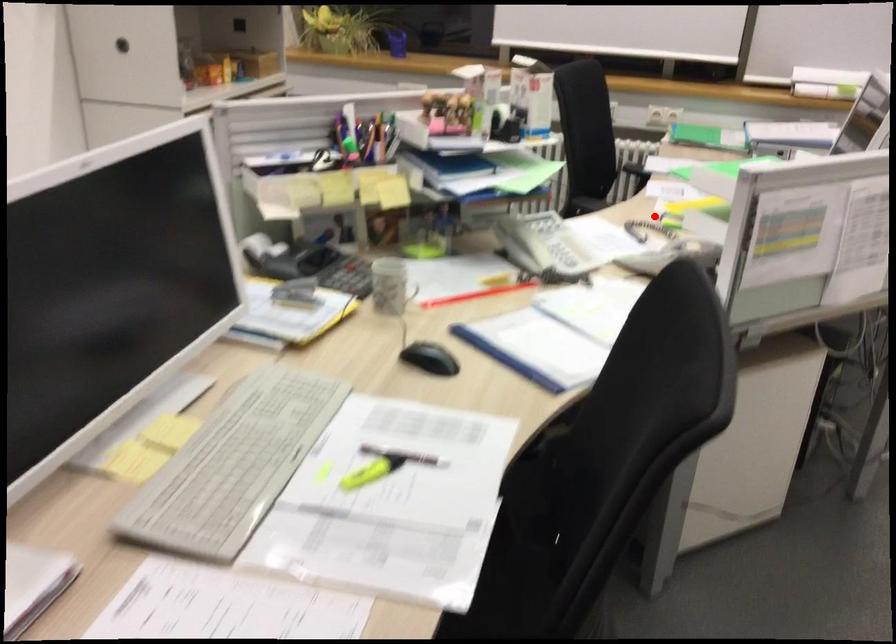
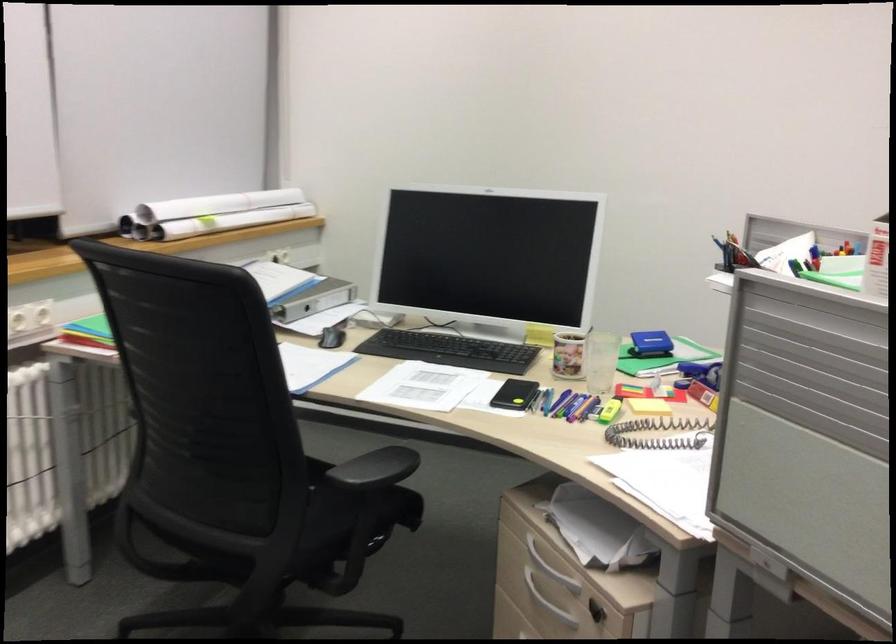
Locate, in the second image, the point that corresponds to the highlighted location in the first image.

(609, 411)